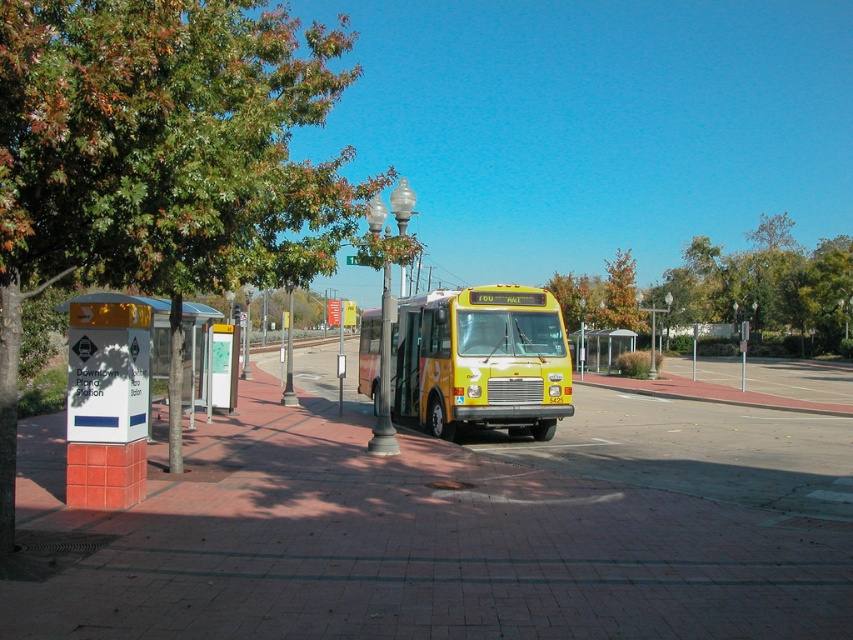
Question: Which object is closer to the camera taking this photo?

Choices:
 (A) yellow matte bus at center
 (B) brick pavement at center

Answer: (B)

Question: Is brick pavement at center wider than green leafy tree at center?

Choices:
 (A) yes
 (B) no

Answer: (B)

Question: Which object is positioned farthest from the yellow matte bus at center?

Choices:
 (A) brick pavement at center
 (B) green leafy tree at center

Answer: (B)

Question: Can you confirm if green leafy tree at upper left is positioned above yellow matte bus at center?

Choices:
 (A) no
 (B) yes

Answer: (B)

Question: Is brick pavement at center thinner than yellow matte bus at center?

Choices:
 (A) yes
 (B) no

Answer: (B)

Question: Estimate the real-world distances between objects in this image. Which object is closer to the brick pavement at center?

Choices:
 (A) green leafy tree at center
 (B) yellow matte bus at center

Answer: (B)